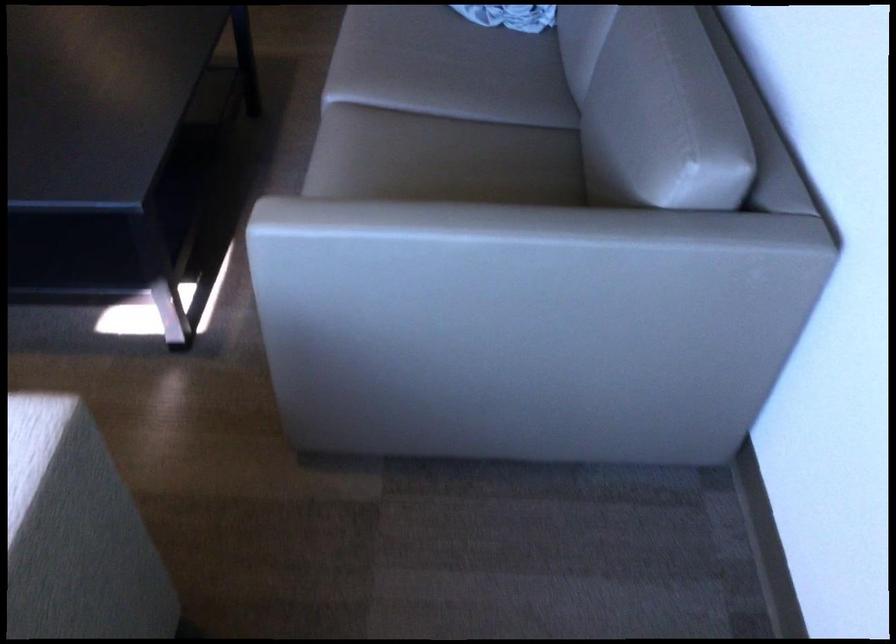
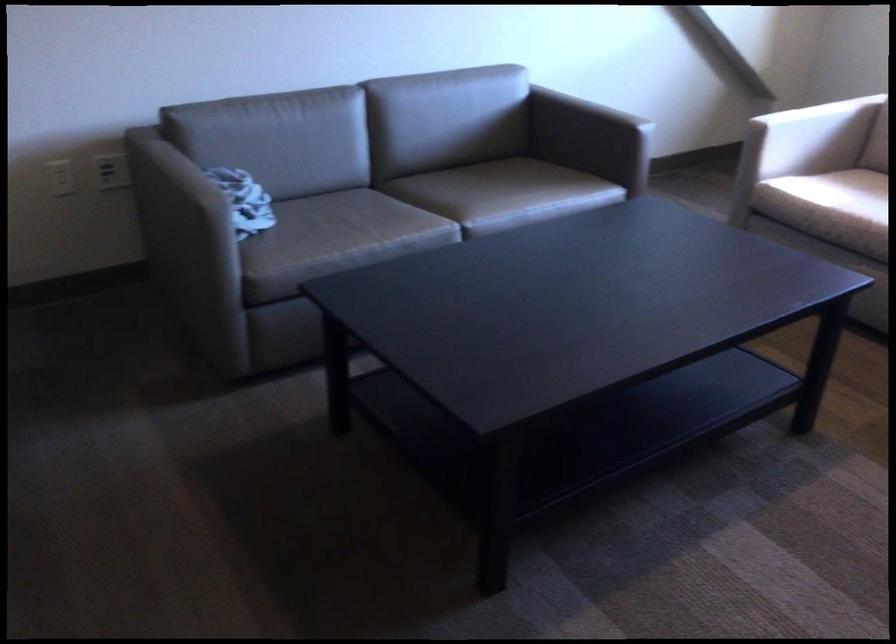
In the second image, find the point that corresponds to point (362, 146) in the first image.

(489, 194)